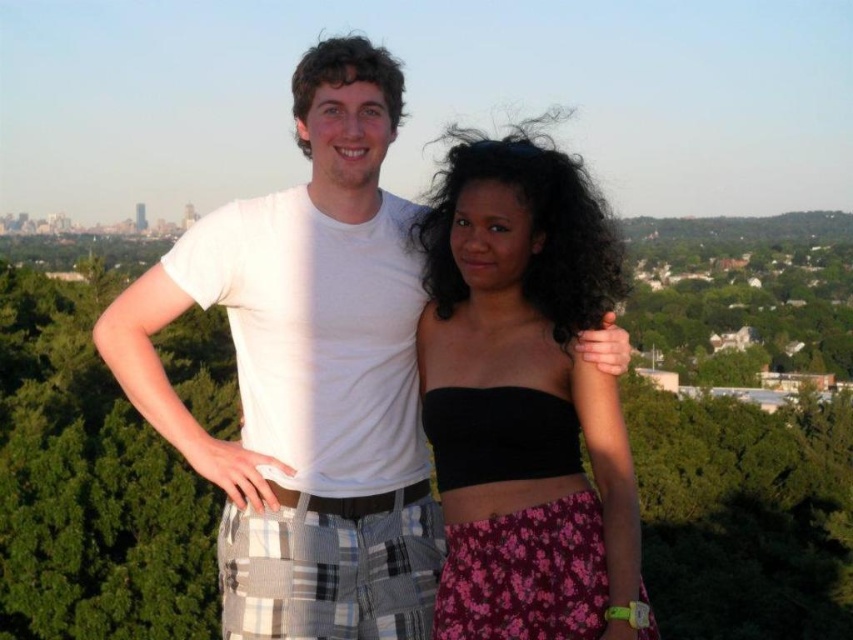
Question: Is the position of white cotton t-shirt at center more distant than that of black matte strapless top at center?

Choices:
 (A) no
 (B) yes

Answer: (B)

Question: Does white cotton t-shirt at center come behind black matte strapless top at center?

Choices:
 (A) no
 (B) yes

Answer: (B)

Question: Among these points, which one is nearest to the camera?

Choices:
 (A) (368, 61)
 (B) (558, 516)

Answer: (B)

Question: Is white cotton t-shirt at center to the left of black matte strapless top at center from the viewer's perspective?

Choices:
 (A) no
 (B) yes

Answer: (B)

Question: Which of the following is the farthest from the observer?

Choices:
 (A) black matte strapless top at center
 (B) white cotton t-shirt at center

Answer: (B)